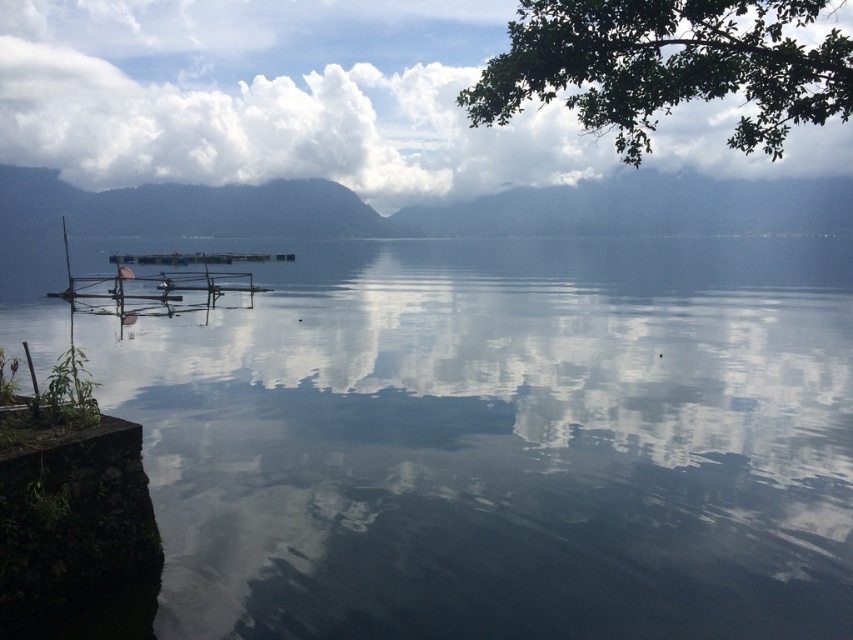
Question: Does transparent water at center lie in front of green leafy branch at upper right?

Choices:
 (A) no
 (B) yes

Answer: (B)

Question: Which of the following is the farthest from the observer?

Choices:
 (A) (517, 257)
 (B) (206, 289)
 (C) (616, 93)
 (D) (137, 256)

Answer: (D)

Question: From the image, what is the correct spatial relationship of green leafy branch at upper right in relation to wooden dock at center?

Choices:
 (A) below
 (B) above

Answer: (B)

Question: Which is nearer to the green leafy branch at upper right?

Choices:
 (A) transparent water at center
 (B) wooden dock at center
 (C) wooden raft at center

Answer: (A)

Question: Is green leafy branch at upper right wider than wooden raft at center?

Choices:
 (A) yes
 (B) no

Answer: (A)

Question: Among these objects, which one is nearest to the camera?

Choices:
 (A) wooden dock at center
 (B) transparent water at center

Answer: (B)